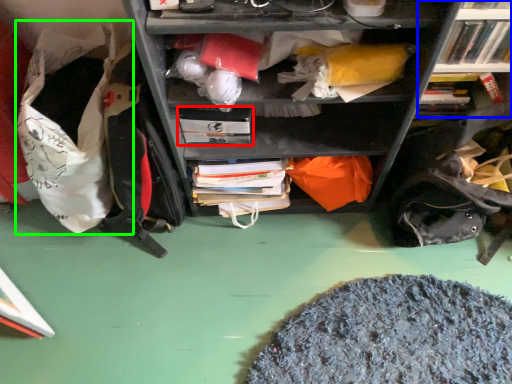
Question: Which is farther away from paperback book (highlighted by a red box)? bookcase (highlighted by a blue box) or bean bag chair (highlighted by a green box)?

Choices:
 (A) bookcase
 (B) bean bag chair

Answer: (A)